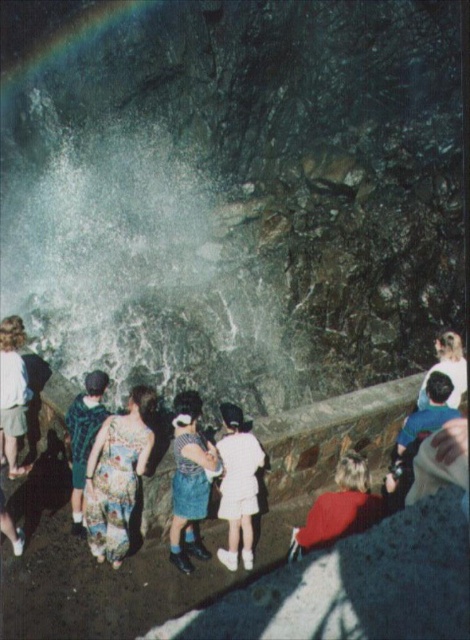
Between red wool sweater at center and white matte shirt at right, which one appears on the right side from the viewer's perspective?

From the viewer's perspective, white matte shirt at right appears more on the right side.

Can you confirm if red wool sweater at center is positioned to the left of white matte shirt at right?

Correct, you'll find red wool sweater at center to the left of white matte shirt at right.

Who is more distant from viewer, (351, 531) or (459, 346)?

Point (459, 346)

You are a GUI agent. You are given a task and a screenshot of the screen. Output one action in this format:
    pyautogui.click(x=<x>, y=<y>)
    Task: Click on the red wool sweater at center
    
    Given the screenshot: What is the action you would take?
    pyautogui.click(x=338, y=508)

Between point (329, 534) and point (70, 413), which one is positioned behind?

The point (70, 413) is more distant.

Is red wool sweater at center above green fabric dress at lower left?

No.

Who is more forward, (318, 538) or (83, 429)?

Point (318, 538)

This screenshot has width=470, height=640. What are the coordinates of `red wool sweater at center` in the screenshot? It's located at (338, 508).

Does point (115, 419) come closer to viewer compared to point (2, 435)?

Yes, it is.

What do you see at coordinates (117, 476) in the screenshot? The height and width of the screenshot is (640, 470). I see `floral fabric dress at center` at bounding box center [117, 476].

Where is `floral fabric dress at center`? This screenshot has width=470, height=640. floral fabric dress at center is located at coordinates (117, 476).